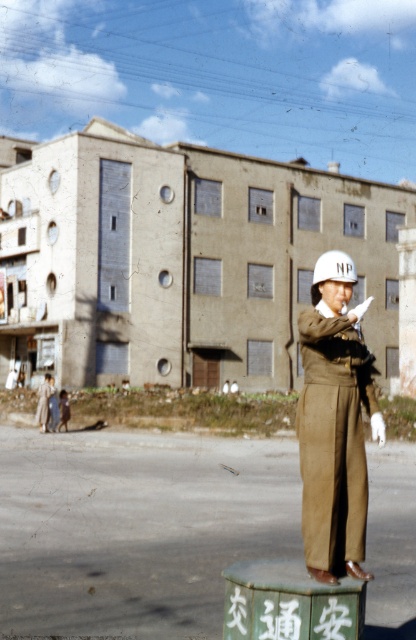
Question: Among these objects, which one is nearest to the camera?

Choices:
 (A) white matte helmet at center
 (B) matte khaki uniform at center

Answer: (B)

Question: Does matte khaki uniform at center come in front of white matte helmet at center?

Choices:
 (A) no
 (B) yes

Answer: (B)

Question: Can you confirm if matte khaki uniform at center is positioned to the left of white matte helmet at center?

Choices:
 (A) no
 (B) yes

Answer: (B)

Question: Among these objects, which one is farthest from the camera?

Choices:
 (A) matte khaki uniform at center
 (B) white matte helmet at center

Answer: (B)

Question: From the image, what is the correct spatial relationship of matte khaki uniform at center in relation to white matte helmet at center?

Choices:
 (A) above
 (B) below

Answer: (B)

Question: Which object appears farthest from the camera in this image?

Choices:
 (A) matte khaki uniform at center
 (B) white matte helmet at center

Answer: (B)